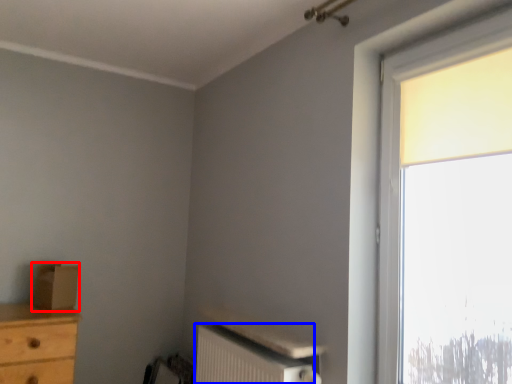
Question: Which of the following is the farthest to the observer, cardboard box (highlighted by a red box) or radiator (highlighted by a blue box)?

Choices:
 (A) cardboard box
 (B) radiator

Answer: (A)